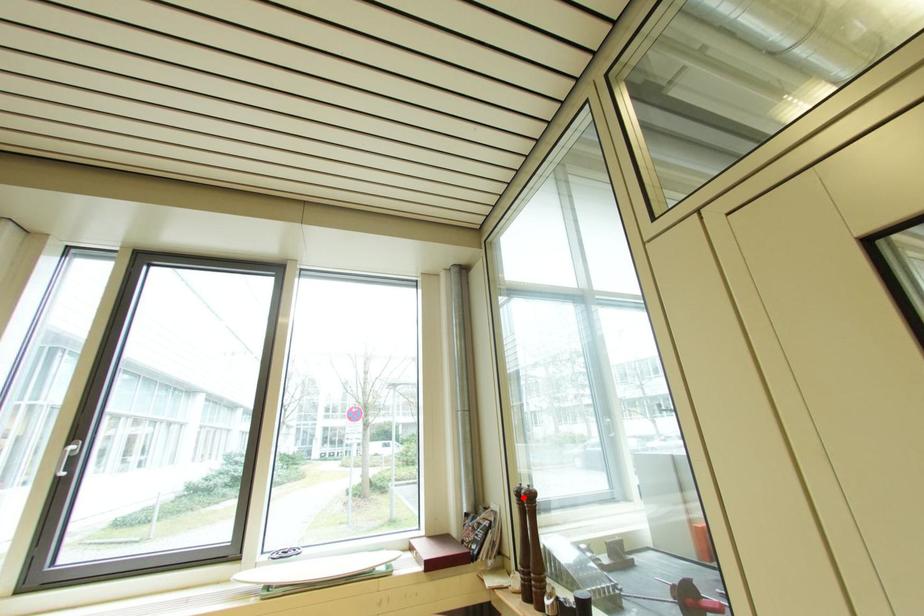
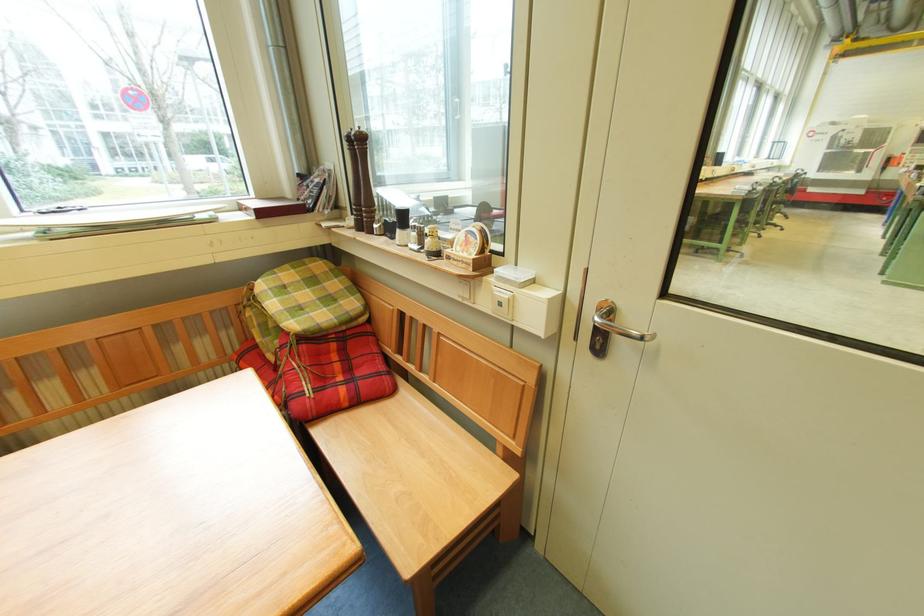
Where in the second image is the point corresponding to the highlighted location from the first image?

(354, 144)